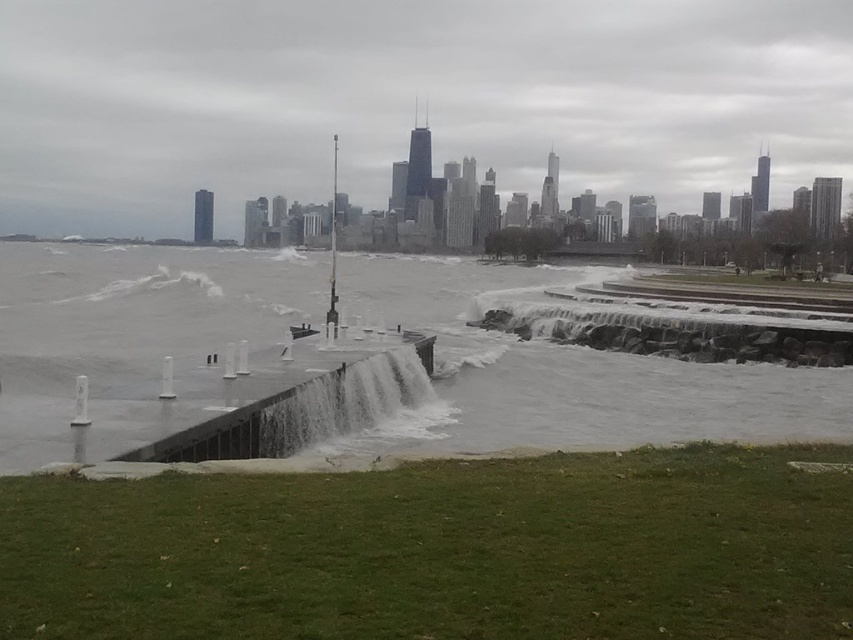
You are a city planner reviewing this waterfront park design. The clear concrete water at center and the gray concrete waterfall at center are part of the walkway structure. Based on their heights, which one is more likely to be submerged during heavy rainfall? Explain your reasoning using the objects provided.

The clear concrete water at center is taller than the gray concrete waterfall at center. During heavy rainfall, water levels rise, so the lower elevation of the gray concrete waterfall at center makes it more susceptible to being submerged first.